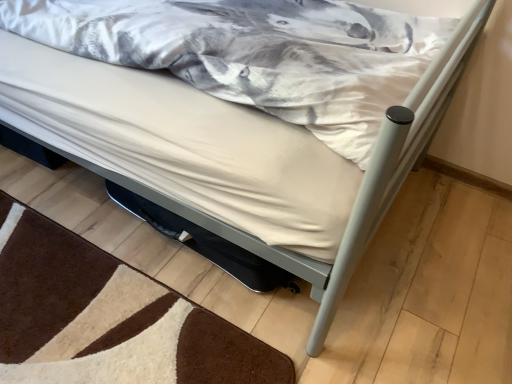
This screenshot has height=384, width=512. I want to click on vacant space underneath brown shaggy rug at lower left (from a real-world perspective), so click(94, 317).